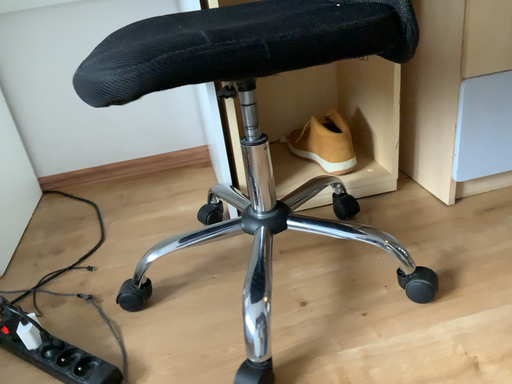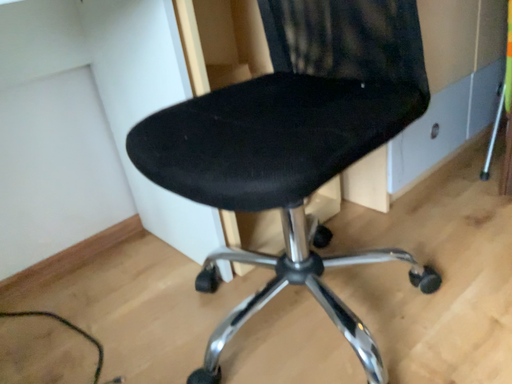
Question: How did the camera likely rotate when shooting the video?

Choices:
 (A) rotated upward
 (B) rotated downward

Answer: (A)